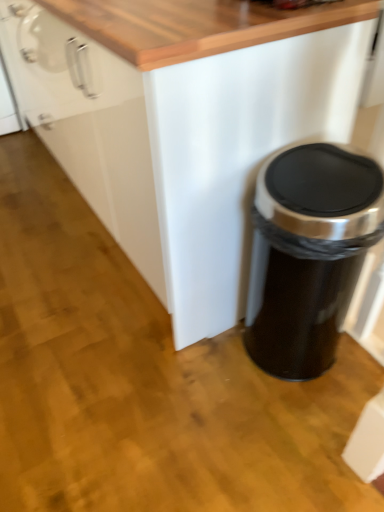
Question: Do you think black matte trash can at lower right is within white matte cabinet at center, or outside of it?

Choices:
 (A) inside
 (B) outside

Answer: (B)

Question: Based on their sizes in the image, would you say black matte trash can at lower right is bigger or smaller than white matte cabinet at center?

Choices:
 (A) big
 (B) small

Answer: (B)

Question: From the image's perspective, is black matte trash can at lower right located above or below white matte cabinet at center?

Choices:
 (A) above
 (B) below

Answer: (B)

Question: From the image's perspective, is white matte cabinet at center above or below black matte trash can at lower right?

Choices:
 (A) below
 (B) above

Answer: (B)

Question: Looking at the image, does white matte cabinet at center seem bigger or smaller compared to black matte trash can at lower right?

Choices:
 (A) big
 (B) small

Answer: (A)

Question: Does point (172, 117) appear closer or farther from the camera than point (314, 334)?

Choices:
 (A) closer
 (B) farther

Answer: (A)

Question: In terms of width, does white matte cabinet at center look wider or thinner when compared to black matte trash can at lower right?

Choices:
 (A) wide
 (B) thin

Answer: (A)